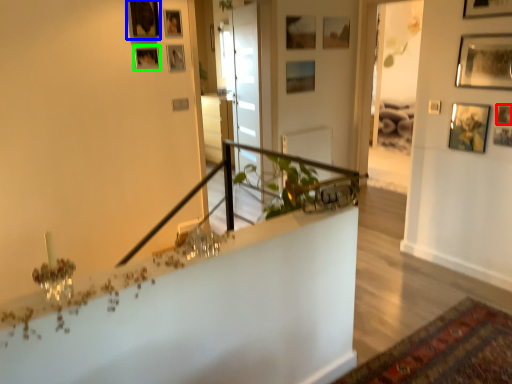
Question: Which object is positioned closest to picture frame (highlighted by a red box)? Select from picture frame (highlighted by a blue box) and picture frame (highlighted by a green box).

Choices:
 (A) picture frame
 (B) picture frame

Answer: (B)